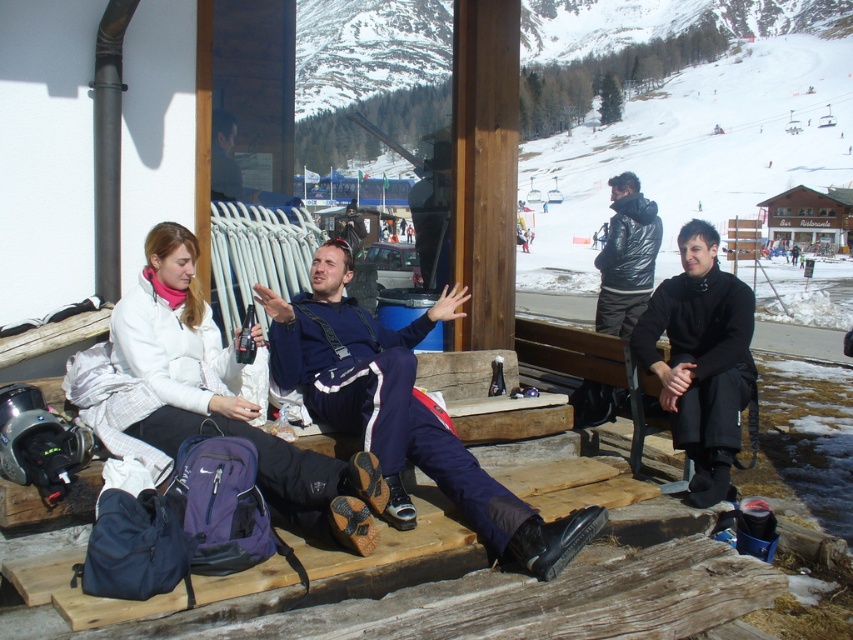
The image size is (853, 640). Find the location of `white fleece jacket at left`. white fleece jacket at left is located at coordinates (229, 401).

Which is in front, point (195, 323) or point (608, 406)?

Positioned in front is point (195, 323).

The image size is (853, 640). Find the location of `white fleece jacket at left`. white fleece jacket at left is located at coordinates (229, 401).

Consider the image. Can you confirm if navy blue ski suit at center is positioned above black leather jacket at right?

Actually, navy blue ski suit at center is below black leather jacket at right.

Which is above, navy blue ski suit at center or black leather jacket at right?

black leather jacket at right

Does point (323, 266) come behind point (637, 259)?

No, it is not.

Identify the location of navy blue ski suit at center. (402, 410).

Which is below, navy blue ski suit at center or white fleece jacket at left?

white fleece jacket at left is below.

Between navy blue ski suit at center and white fleece jacket at left, which one has less height?

white fleece jacket at left is shorter.

The image size is (853, 640). Identify the location of navy blue ski suit at center. (402, 410).